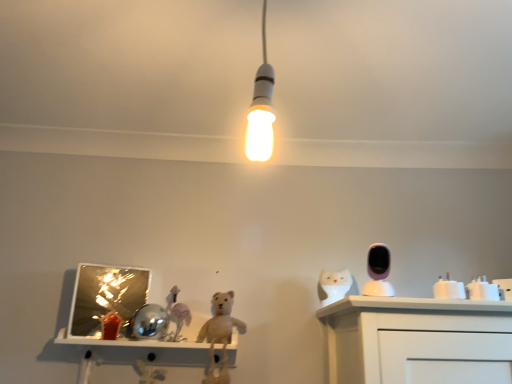
Question: Can you confirm if white glossy owl at right is thinner than white glossy plug at right, which ranks as the 2th toy in back-to-front order?

Choices:
 (A) no
 (B) yes

Answer: (A)

Question: From a real-world perspective, is white glossy owl at right positioned over white glossy plug at right, the 4th toy positioned from the left, based on gravity?

Choices:
 (A) no
 (B) yes

Answer: (B)

Question: Is white glossy owl at right positioned beyond the bounds of white glossy plug at right, the 4th toy positioned from the left?

Choices:
 (A) yes
 (B) no

Answer: (A)

Question: Is white glossy owl at right positioned with its back to white glossy plug at right, which ranks as the 2th toy in back-to-front order?

Choices:
 (A) yes
 (B) no

Answer: (B)

Question: Considering the relative sizes of white glossy owl at right and white glossy plug at right, which is the 1th toy from right to left, in the image provided, is white glossy owl at right smaller than white glossy plug at right, which is the 1th toy from right to left,?

Choices:
 (A) no
 (B) yes

Answer: (A)

Question: In the image, is white glossy plug at right, which ranks as the 2th toy in back-to-front order, positioned in front of or behind white glossy cup at right, which is the third toy from left to right?

Choices:
 (A) front
 (B) behind

Answer: (B)

Question: From their relative heights in the image, would you say white glossy plug at right, placed as the third toy when sorted from front to back, is taller or shorter than white glossy cup at right, the 2th toy in the front-to-back sequence?

Choices:
 (A) short
 (B) tall

Answer: (B)

Question: In the image, is white glossy plug at right, which is the 1th toy from right to left, on the left side or the right side of white glossy cup at right, the 2th toy in the right-to-left sequence?

Choices:
 (A) left
 (B) right

Answer: (B)

Question: From a real-world perspective, relative to white glossy cup at right, which is the third toy from back to front, is white glossy plug at right, the 4th toy positioned from the left, vertically above or below?

Choices:
 (A) above
 (B) below

Answer: (A)

Question: Is pink glossy security camera at upper right, the fourth toy in the back-to-front sequence, in front of or behind matte pink horse at center, placed as the 1th toy when sorted from left to right, in the image?

Choices:
 (A) behind
 (B) front

Answer: (B)

Question: Does point (385, 292) appear closer or farther from the camera than point (178, 306)?

Choices:
 (A) farther
 (B) closer

Answer: (B)

Question: Looking at the image, does pink glossy security camera at upper right, which is the 2th toy from left to right, seem bigger or smaller compared to matte pink horse at center, acting as the 4th toy starting from the right?

Choices:
 (A) small
 (B) big

Answer: (A)

Question: Choose the correct answer: Is pink glossy security camera at upper right, which is the 2th toy from left to right, inside matte pink horse at center, acting as the 4th toy starting from the right, or outside it?

Choices:
 (A) inside
 (B) outside

Answer: (B)

Question: From a real-world perspective, is matte pink horse at center, acting as the 4th toy starting from the right, physically located above or below white glossy owl at right?

Choices:
 (A) above
 (B) below

Answer: (B)

Question: From the image's perspective, relative to white glossy owl at right, is matte pink horse at center, acting as the 4th toy starting from the right, above or below?

Choices:
 (A) below
 (B) above

Answer: (A)